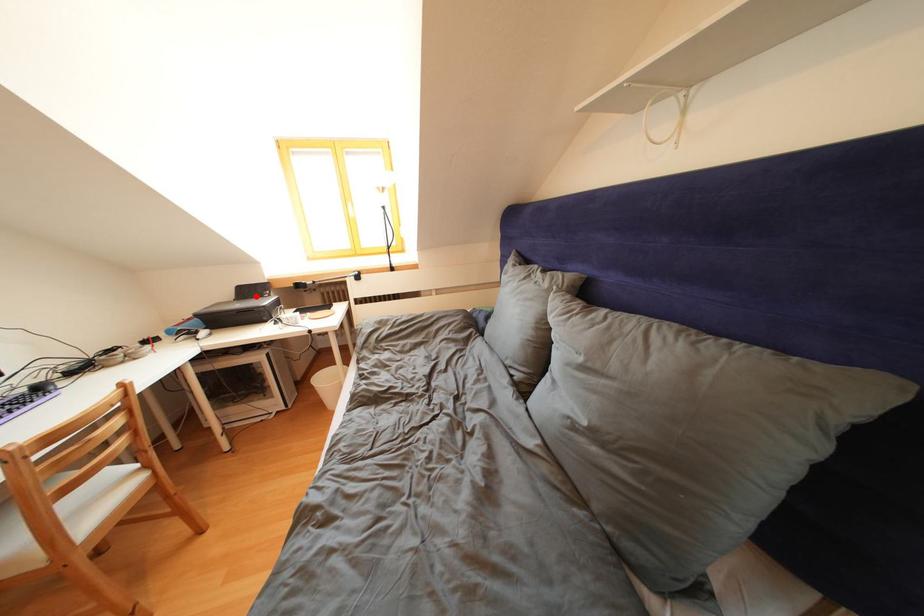
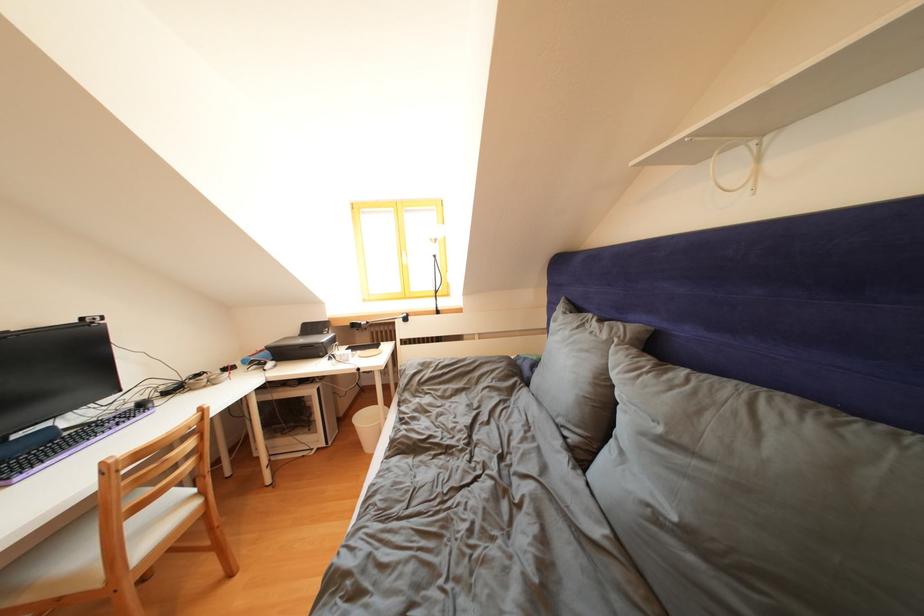
Where in the second image is the point corresponding to the highlighted location from the first image?

(319, 333)